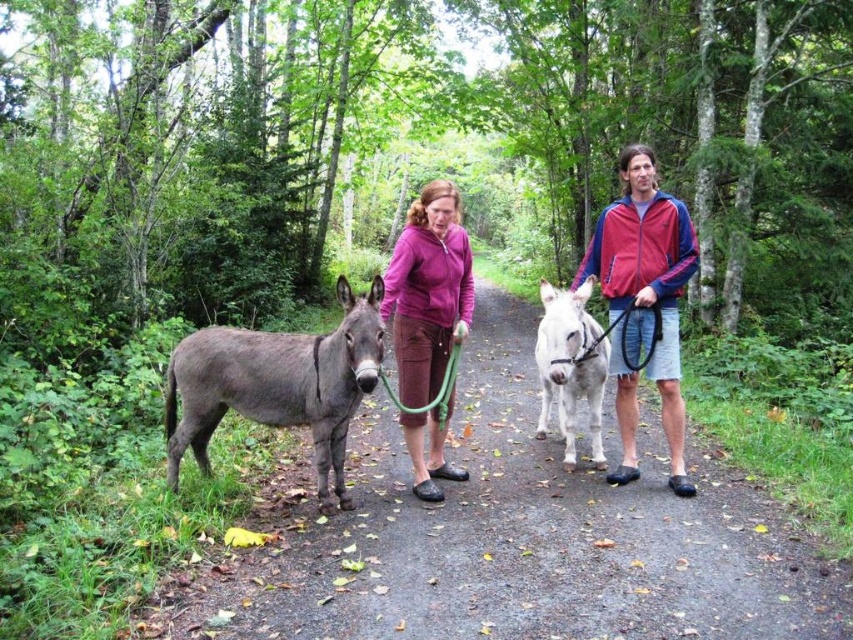
Question: Which of the following is the farthest from the observer?

Choices:
 (A) smooth dirt path at center
 (B) matte purple jacket at center

Answer: (B)

Question: Is smooth dirt path at center closer to camera compared to white matte mule at center?

Choices:
 (A) yes
 (B) no

Answer: (A)

Question: Where is smooth dirt path at center located in relation to gray matte mule at left in the image?

Choices:
 (A) right
 (B) left

Answer: (A)

Question: Considering the real-world distances, which object is closest to the smooth dirt path at center?

Choices:
 (A) green rubber hose at center
 (B) white matte mule at center

Answer: (A)

Question: Is smooth dirt path at center wider than matte pink jacket at center?

Choices:
 (A) no
 (B) yes

Answer: (B)

Question: Among these points, which one is nearest to the camera?

Choices:
 (A) (445, 396)
 (B) (682, 481)

Answer: (A)